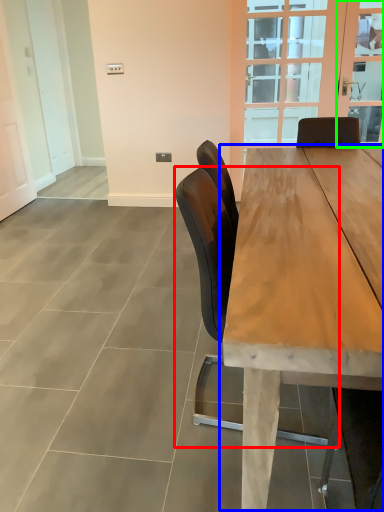
Question: Which object is the farthest from chair (highlighted by a red box)? Choose among these: table (highlighted by a blue box) or window screen (highlighted by a green box).

Choices:
 (A) table
 (B) window screen

Answer: (B)